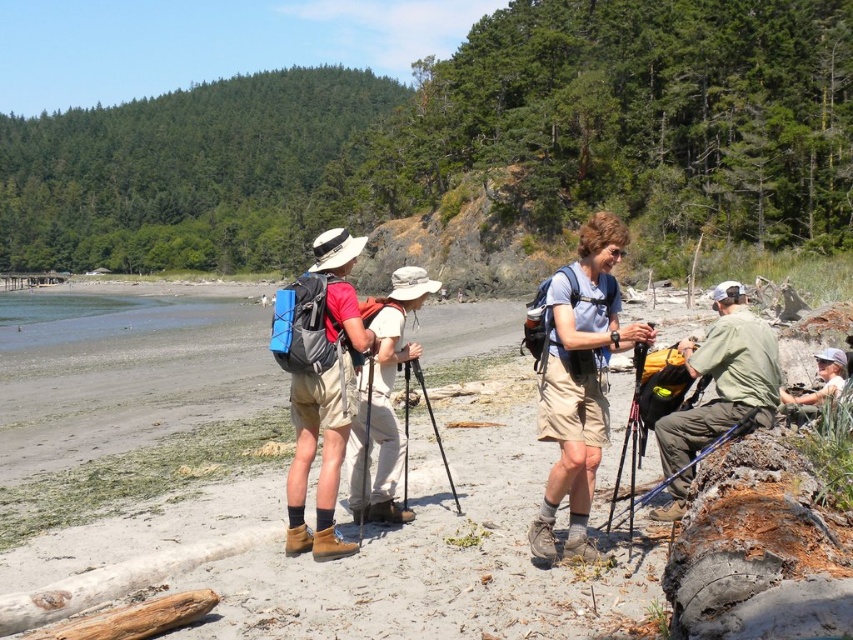
Question: Which point appears closest to the camera in this image?

Choices:
 (A) (222, 496)
 (B) (405, 426)

Answer: (A)

Question: Which object is positioned closest to the light brown wooden stick at lower right?

Choices:
 (A) matte blue backpack at center
 (B) khaki cotton shorts at center

Answer: (A)

Question: Is the position of green fabric backpack at center less distant than that of light brown wooden stick at lower right?

Choices:
 (A) yes
 (B) no

Answer: (A)

Question: Which object is farther from the camera taking this photo?

Choices:
 (A) khaki cotton shorts at center
 (B) light brown wooden stick at lower right

Answer: (B)

Question: Where is green fabric backpack at center located in relation to light brown wooden stick at lower right in the image?

Choices:
 (A) above
 (B) below

Answer: (B)

Question: Observing the image, what is the correct spatial positioning of smooth sand beach at center in reference to black metal tripod at center?

Choices:
 (A) below
 (B) above

Answer: (B)